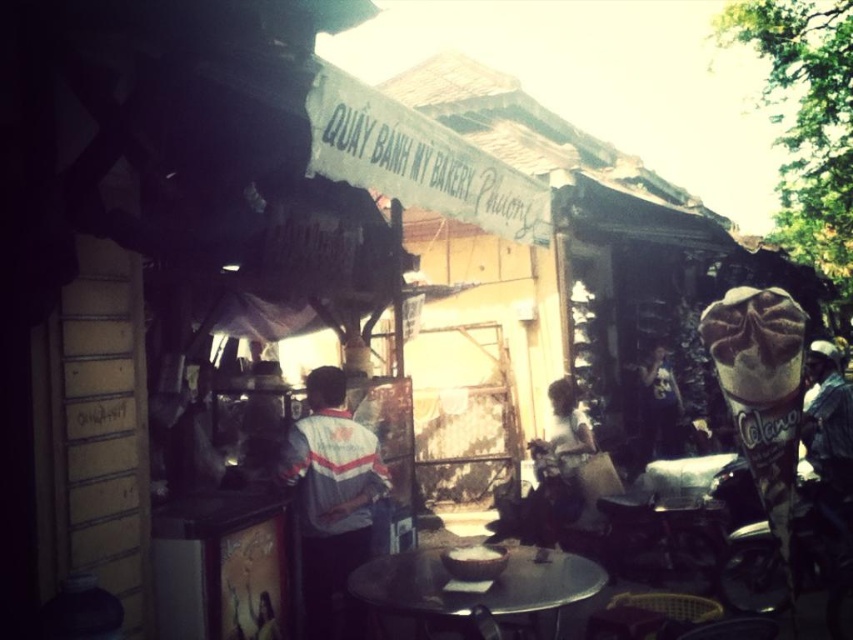
Which is above, gray striped shirt at center or metallic round table at center?

gray striped shirt at center is above.

The height and width of the screenshot is (640, 853). What do you see at coordinates (331, 493) in the screenshot? I see `gray striped shirt at center` at bounding box center [331, 493].

Between point (350, 456) and point (386, 584), which one is positioned in front?

Positioned in front is point (386, 584).

This screenshot has height=640, width=853. I want to click on gray striped shirt at center, so click(331, 493).